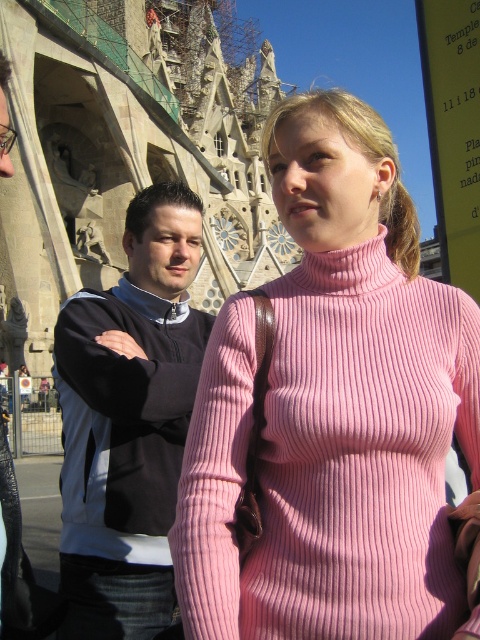
Question: Can you confirm if pink ribbed sweater at center is positioned to the left of black fabric jacket at left?

Choices:
 (A) yes
 (B) no

Answer: (B)

Question: Which object appears closest to the camera in this image?

Choices:
 (A) black fabric jacket at left
 (B) pink ribbed sweater at center

Answer: (B)

Question: Which point is farther from the camera taking this photo?

Choices:
 (A) (425, 284)
 (B) (194, 394)

Answer: (B)

Question: Can you confirm if pink ribbed sweater at center is positioned to the right of black fabric jacket at left?

Choices:
 (A) no
 (B) yes

Answer: (B)

Question: Can you confirm if pink ribbed sweater at center is positioned to the right of black fabric jacket at left?

Choices:
 (A) no
 (B) yes

Answer: (B)